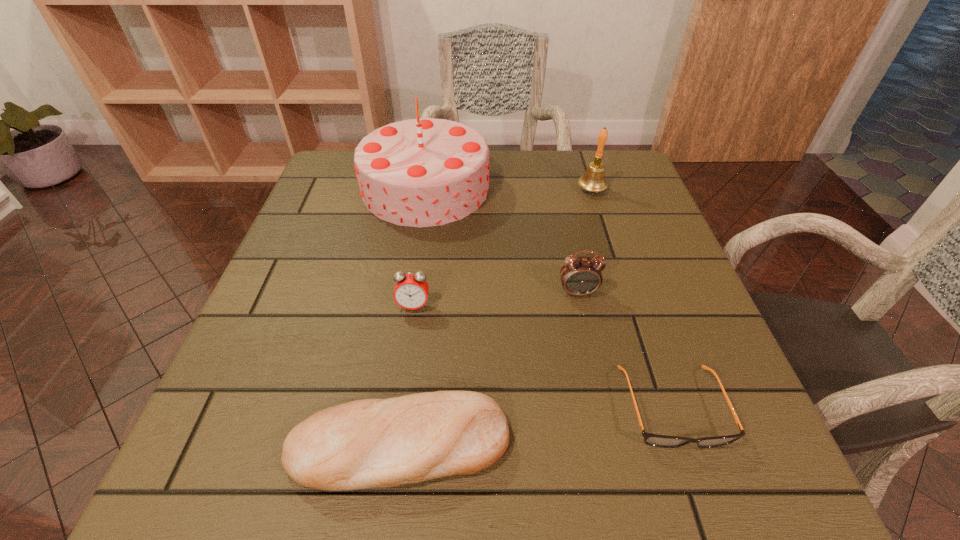
Locate an element on the screen. Image resolution: width=960 pixels, height=540 pixels. free region located 0.070m on the front-facing side of the left alarm clock is located at coordinates (408, 344).

Locate an element on the screen. vacant space located 0.310m on the right of the bread is located at coordinates (716, 444).

Where is `birthday cake at the far edge`? birthday cake at the far edge is located at coordinates (424, 172).

The height and width of the screenshot is (540, 960). Find the location of `bell that is at the far edge`. bell that is at the far edge is located at coordinates (593, 180).

Find the location of a particular element. bread situated at the near edge is located at coordinates (371, 443).

Where is `spectacles situated at the near edge`? Image resolution: width=960 pixels, height=540 pixels. spectacles situated at the near edge is located at coordinates (655, 440).

Find the location of `birthday cake present at the left edge`. birthday cake present at the left edge is located at coordinates (424, 172).

This screenshot has height=540, width=960. I want to click on bread present at the left edge, so click(371, 443).

The image size is (960, 540). In order to click on bell at the right edge in this screenshot , I will do `click(593, 180)`.

Where is `spectacles that is at the right edge`? spectacles that is at the right edge is located at coordinates (655, 440).